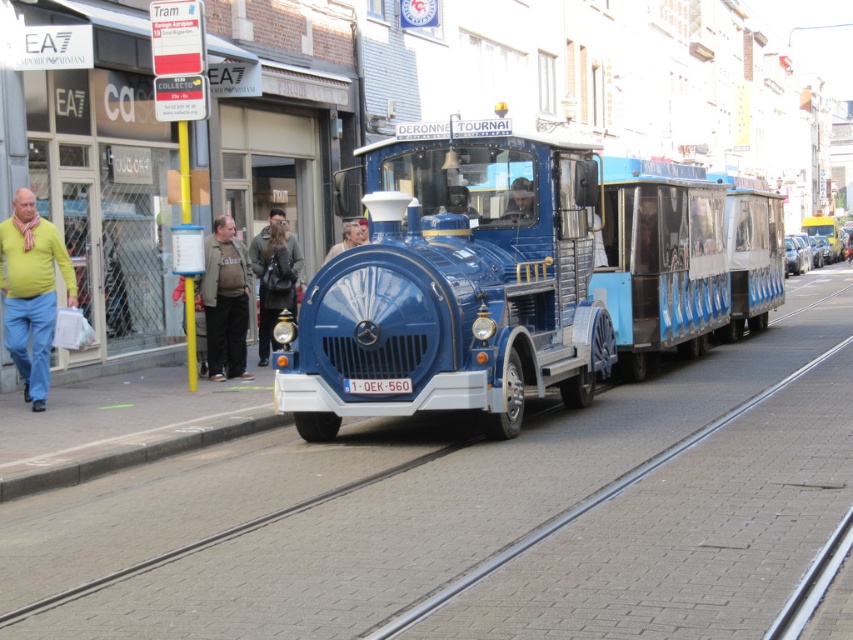
Question: Does matte yellow sweater at left have a larger size compared to dark brown leather jacket at center?

Choices:
 (A) no
 (B) yes

Answer: (A)

Question: Can you confirm if blue metallic train at center is bigger than dark brown leather jacket at center?

Choices:
 (A) no
 (B) yes

Answer: (B)

Question: Which object is positioned farthest from the metallic silver car at center?

Choices:
 (A) dark gray sweater at left
 (B) smooth blue train at center
 (C) light brown leather jacket at center

Answer: (C)

Question: Which object appears closest to the camera in this image?

Choices:
 (A) metallic silver car at center
 (B) smooth blue train at center
 (C) blue metallic train at center
 (D) matte yellow sweater at left

Answer: (C)

Question: Is matte yellow sweater at left below dark gray sweater at left?

Choices:
 (A) no
 (B) yes

Answer: (B)

Question: Among these objects, which one is nearest to the camera?

Choices:
 (A) dark gray sweater at left
 (B) matte yellow sweater at left
 (C) blue metallic train at center
 (D) metallic silver car at center

Answer: (C)